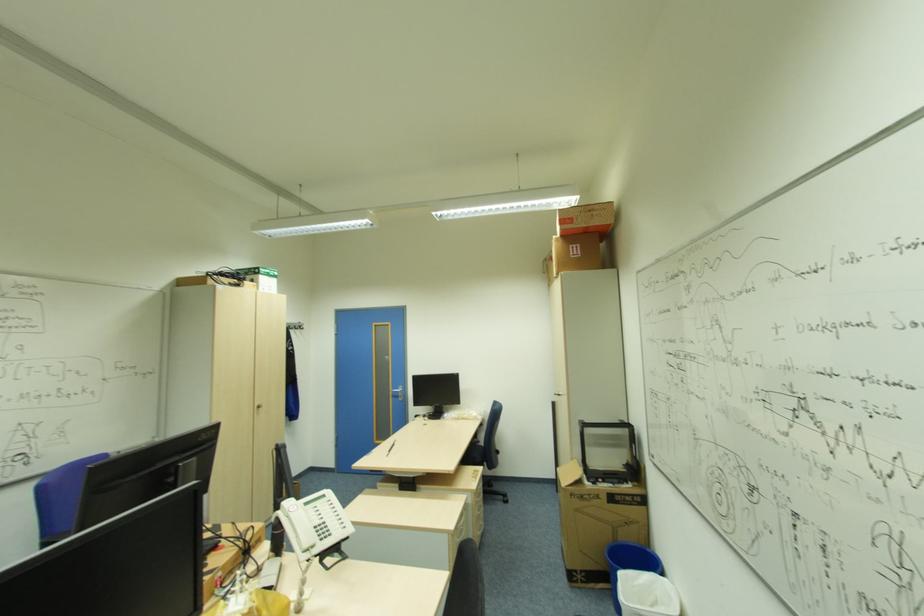
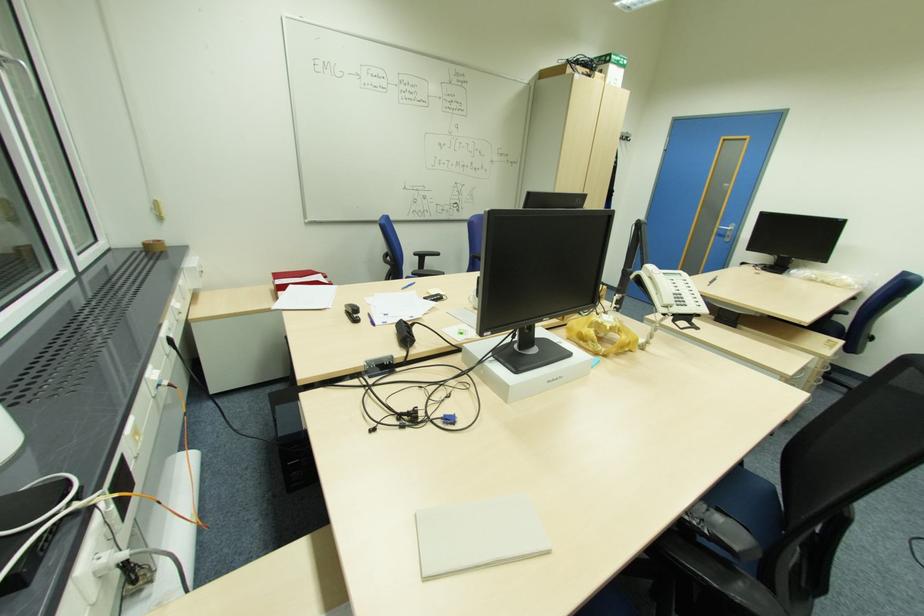
The point at (311, 549) is marked in the first image. Where is the corresponding point in the second image?

(670, 306)